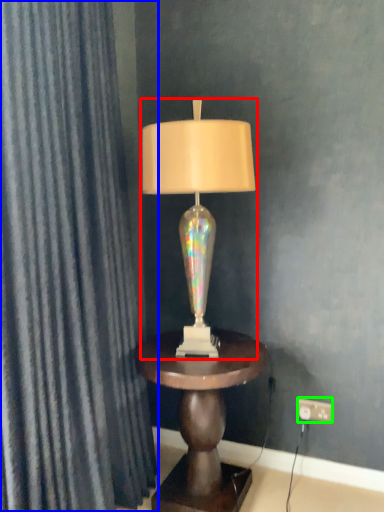
Question: Considering the real-world distances, which object is closest to lamp (highlighted by a red box)? curtain (highlighted by a blue box) or electric outlet (highlighted by a green box).

Choices:
 (A) curtain
 (B) electric outlet

Answer: (A)